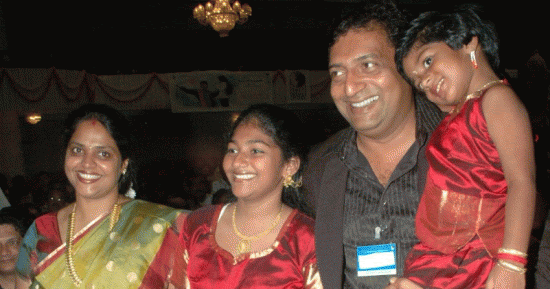
The image size is (550, 289). Identify the location of chandelier. (225, 19).